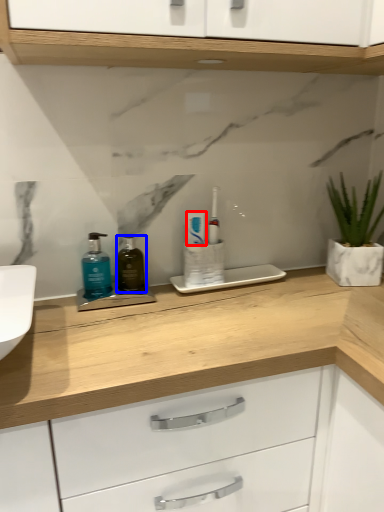
Question: Among these objects, which one is nearest to the camera, toothpaste (highlighted by a red box) or mouthwash (highlighted by a blue box)?

Choices:
 (A) toothpaste
 (B) mouthwash

Answer: (B)